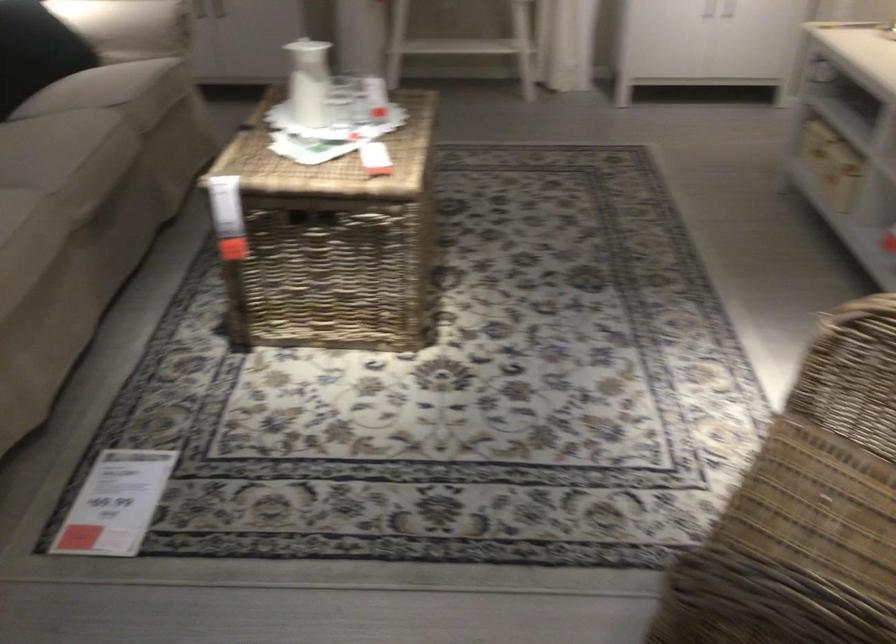
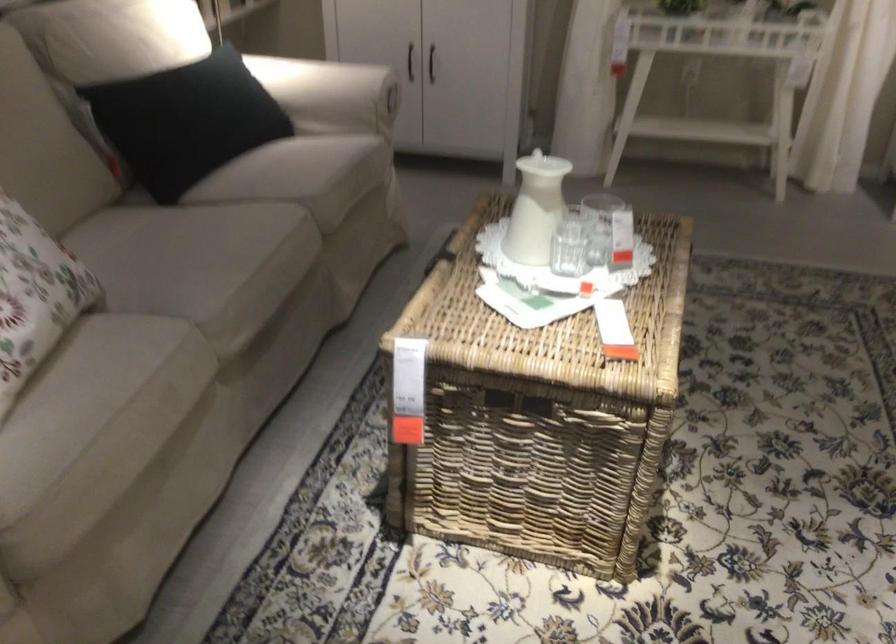
Question: The camera is either moving clockwise (left) or counter-clockwise (right) around the object. The first image is from the beginning of the video and the second image is from the end. Is the camera moving left or right when shooting the video?

Choices:
 (A) Left
 (B) Right

Answer: (B)